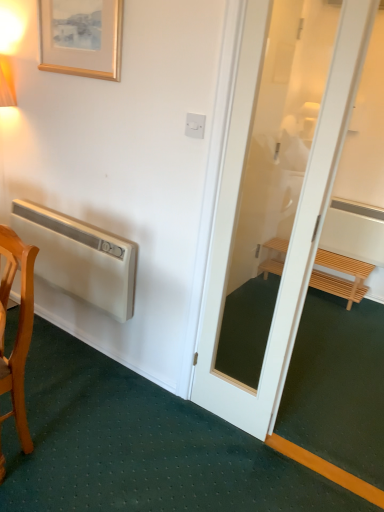
Question: Is wooden framed print at upper left positioned in front of light brown wooden bench at right?

Choices:
 (A) yes
 (B) no

Answer: (A)

Question: Does wooden framed print at upper left have a lesser width compared to light brown wooden bench at right?

Choices:
 (A) no
 (B) yes

Answer: (B)

Question: Is wooden framed print at upper left next to light brown wooden bench at right and touching it?

Choices:
 (A) no
 (B) yes

Answer: (A)

Question: From a real-world perspective, is wooden framed print at upper left beneath light brown wooden bench at right?

Choices:
 (A) no
 (B) yes

Answer: (A)

Question: Is wooden framed print at upper left at the right side of light brown wooden bench at right?

Choices:
 (A) yes
 (B) no

Answer: (B)

Question: Does point (354, 297) appear closer or farther from the camera than point (8, 264)?

Choices:
 (A) closer
 (B) farther

Answer: (B)

Question: Is light brown wooden bench at right in front of or behind wooden chair at lower left in the image?

Choices:
 (A) behind
 (B) front

Answer: (A)

Question: Choose the correct answer: Is light brown wooden bench at right inside wooden chair at lower left or outside it?

Choices:
 (A) inside
 (B) outside

Answer: (B)

Question: From a real-world perspective, is light brown wooden bench at right positioned above or below wooden chair at lower left?

Choices:
 (A) above
 (B) below

Answer: (B)

Question: Is white matte air conditioner at left taller or shorter than wooden chair at lower left?

Choices:
 (A) tall
 (B) short

Answer: (B)

Question: Is white matte air conditioner at left in front of or behind wooden chair at lower left in the image?

Choices:
 (A) behind
 (B) front

Answer: (A)

Question: From a real-world perspective, is white matte air conditioner at left above or below wooden chair at lower left?

Choices:
 (A) above
 (B) below

Answer: (A)

Question: Is white matte air conditioner at left bigger or smaller than wooden chair at lower left?

Choices:
 (A) big
 (B) small

Answer: (B)

Question: In terms of width, does wooden chair at lower left look wider or thinner when compared to white matte air conditioner at left?

Choices:
 (A) thin
 (B) wide

Answer: (B)

Question: Relative to white matte air conditioner at left, is wooden chair at lower left in front or behind?

Choices:
 (A) front
 (B) behind

Answer: (A)